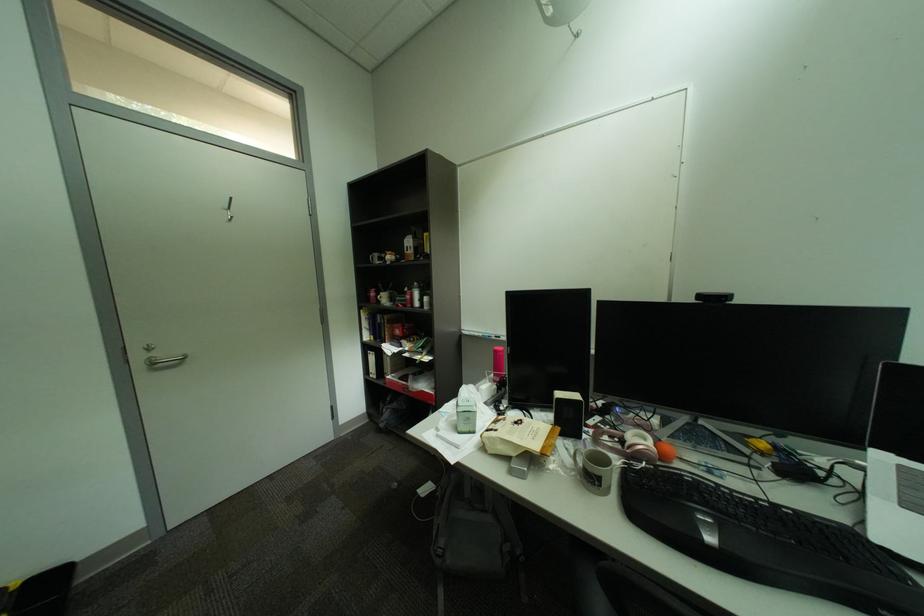
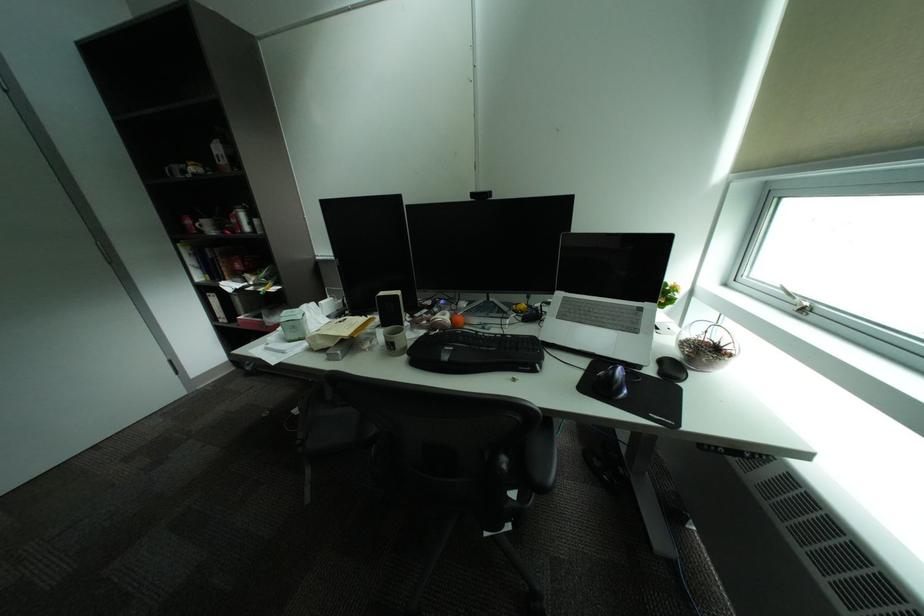
In the second image, find the point that corresponds to [545,410] in the first image.

(385, 314)